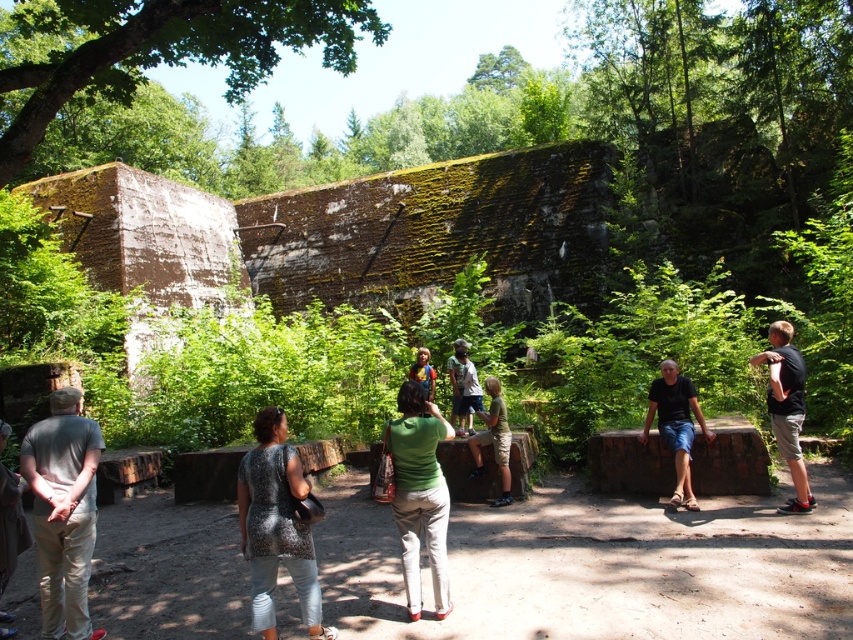
Is matte gray shirt at left taller than green fabric shirt at center?

Yes, matte gray shirt at left is taller than green fabric shirt at center.

Does point (57, 611) come closer to viewer compared to point (415, 490)?

Yes, it is.

I want to click on matte gray shirt at left, so click(x=62, y=512).

Can you confirm if black cotton t-shirt at right is positioned to the right of khaki shorts at center?

Indeed, black cotton t-shirt at right is positioned on the right side of khaki shorts at center.

Does black cotton t-shirt at right appear over khaki shorts at center?

Yes.

Between point (788, 355) and point (479, 444), which one is positioned in front?

Point (788, 355) is more forward.

Identify the location of black cotton t-shirt at right. Image resolution: width=853 pixels, height=640 pixels. (786, 408).

Who is lower down, black cotton t-shirt at right or light brown wooden bench at center?

light brown wooden bench at center is lower down.

Is point (772, 429) more distant than point (454, 340)?

No, it is not.

Where is `black cotton t-shirt at right`? The width and height of the screenshot is (853, 640). black cotton t-shirt at right is located at coordinates click(786, 408).